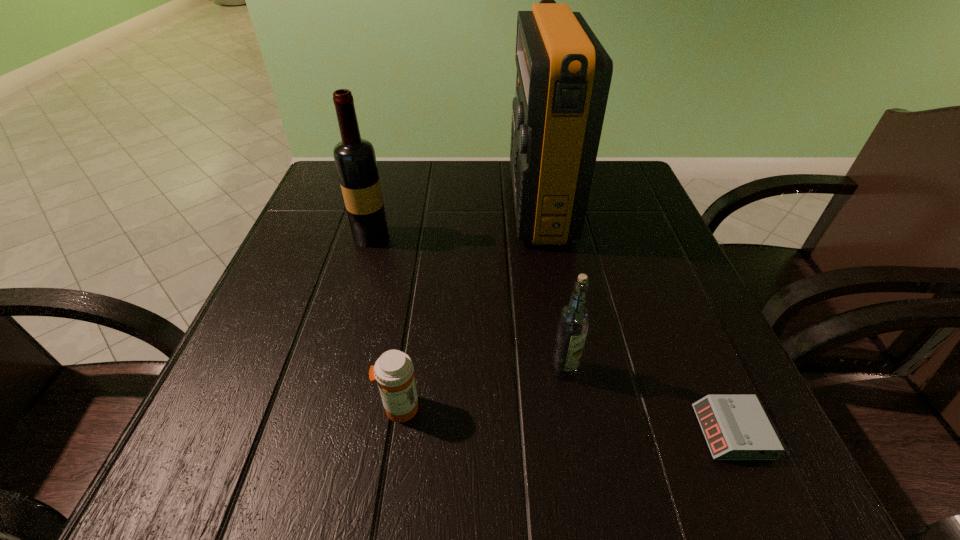
This screenshot has height=540, width=960. Identify the location of vacant position located 0.090m on the front-facing side of the radio receiver. (472, 203).

The image size is (960, 540). In order to click on free space located 0.120m on the front-facing side of the radio receiver in this screenshot , I will do `click(459, 203)`.

This screenshot has height=540, width=960. In order to click on vacant space located 0.320m on the right of the wine bottle in this screenshot , I will do `click(539, 237)`.

I want to click on vacant space positioned on the label of the vodka, so click(x=579, y=457).

Locate an element on the screen. Image resolution: width=960 pixels, height=540 pixels. free space located on the left of the second object from left to right is located at coordinates (311, 408).

You are a GUI agent. You are given a task and a screenshot of the screen. Output one action in this format:
    pyautogui.click(x=<x>, y=<y>)
    Task: Click on the free space located on the left of the alarm clock
    This screenshot has height=540, width=960.
    Given the screenshot: What is the action you would take?
    pyautogui.click(x=479, y=432)

The width and height of the screenshot is (960, 540). I want to click on object present at the far edge, so click(564, 74).

The width and height of the screenshot is (960, 540). In order to click on object that is at the near edge in this screenshot , I will do `click(736, 427)`.

Locate an element on the screen. Image resolution: width=960 pixels, height=540 pixels. object that is at the left edge is located at coordinates (355, 160).

Where is `object that is at the right edge`? object that is at the right edge is located at coordinates (736, 427).